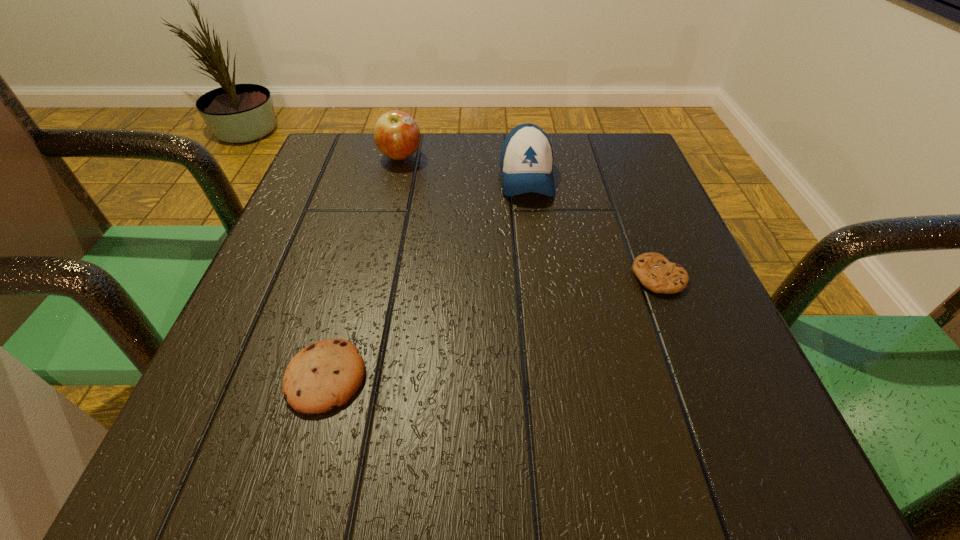
The height and width of the screenshot is (540, 960). In order to click on the second object from right to left in this screenshot , I will do `click(526, 161)`.

Locate an element on the screen. apple is located at coordinates (397, 135).

This screenshot has height=540, width=960. What are the coordinates of `the nearer cookie` in the screenshot? It's located at (327, 373).

Image resolution: width=960 pixels, height=540 pixels. Identify the location of the nearest object. (327, 373).

Identify the location of the farther cookie. (654, 271).

Where is `the rightmost object`? The height and width of the screenshot is (540, 960). the rightmost object is located at coordinates (654, 271).

Image resolution: width=960 pixels, height=540 pixels. What are the coordinates of `free space located on the front-facing side of the third object from left to right` in the screenshot? It's located at (547, 338).

Locate an element on the screen. vacant space located on the front of the apple is located at coordinates (375, 261).

I want to click on free spot located 0.260m on the right of the taller cookie, so [556, 377].

Find the location of a particular element. vacant space located 0.150m on the back of the shortest object is located at coordinates (631, 206).